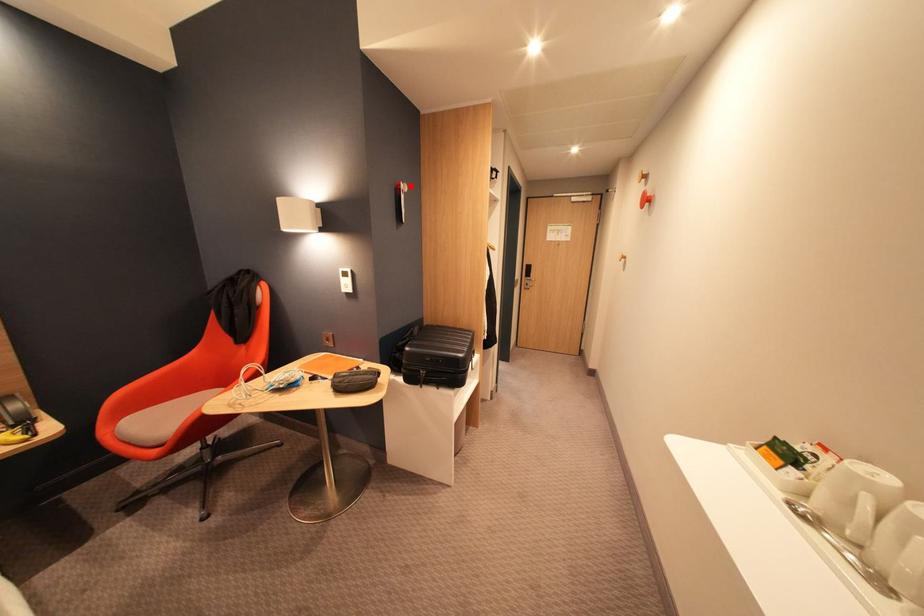
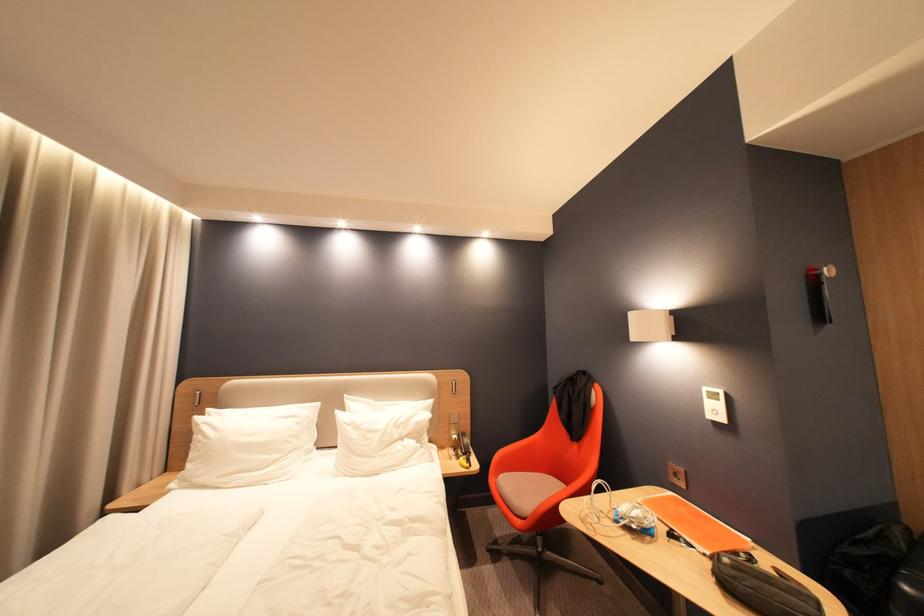
Find the pixel in the second image that matches the highlighted location in the first image.

(830, 270)